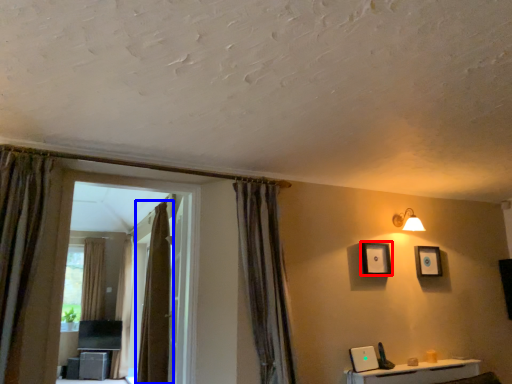
Question: Which object appears closest to the camera in this image, picture frame (highlighted by a red box) or curtain (highlighted by a blue box)?

Choices:
 (A) picture frame
 (B) curtain

Answer: (A)